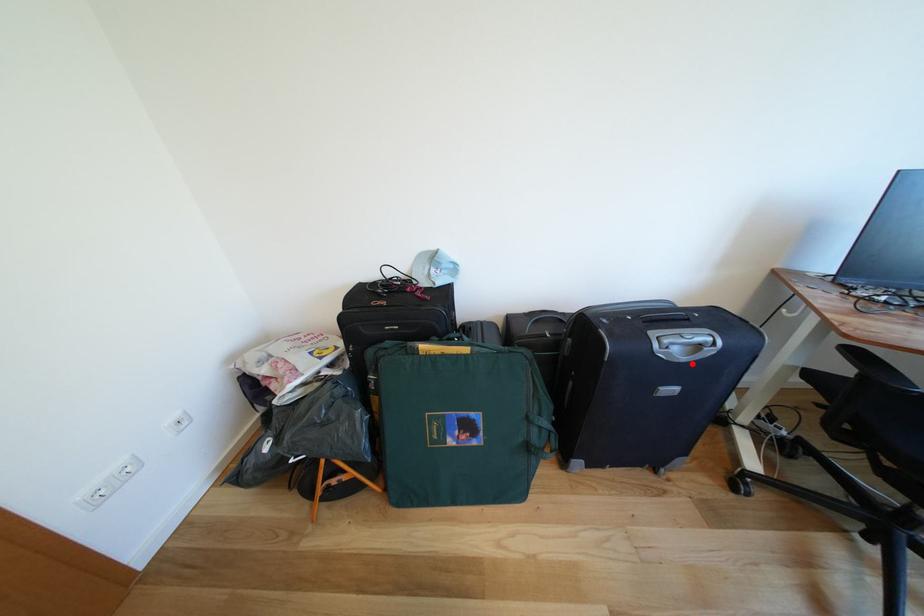
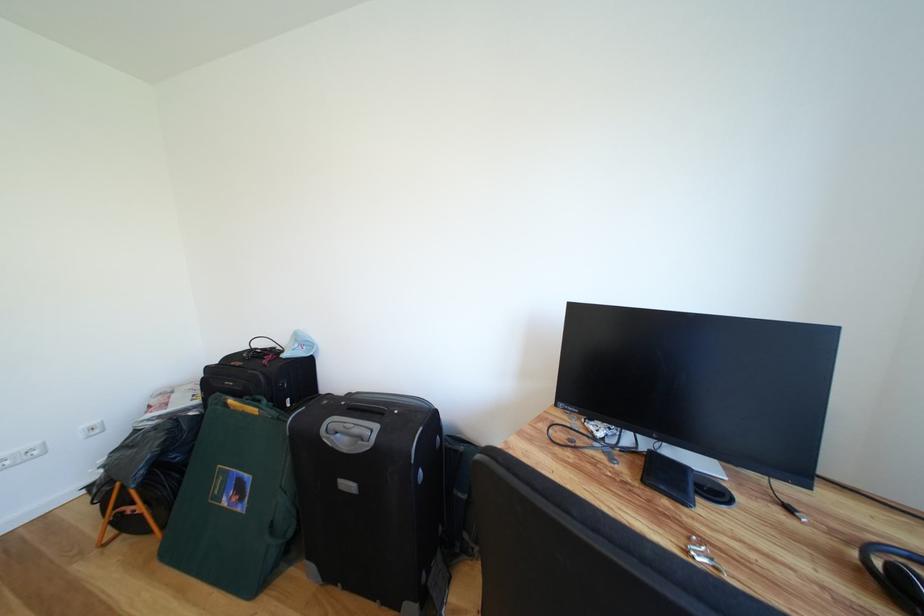
Where in the second image is the point corresponding to the highlighted location from the first image?

(353, 455)